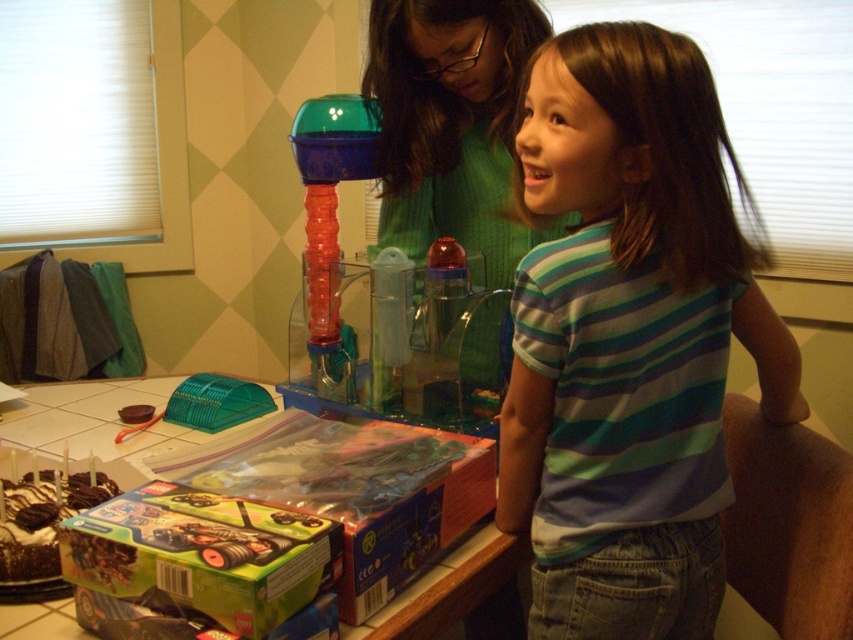
Does striped cotton shirt at center have a lesser height compared to green knitted sweater at upper center?

No, striped cotton shirt at center is not shorter than green knitted sweater at upper center.

Between point (570, 392) and point (505, 205), which one is positioned in front?

Point (570, 392) is more forward.

Describe the element at coordinates (628, 339) in the screenshot. I see `striped cotton shirt at center` at that location.

Identify the location of striped cotton shirt at center. This screenshot has height=640, width=853. (628, 339).